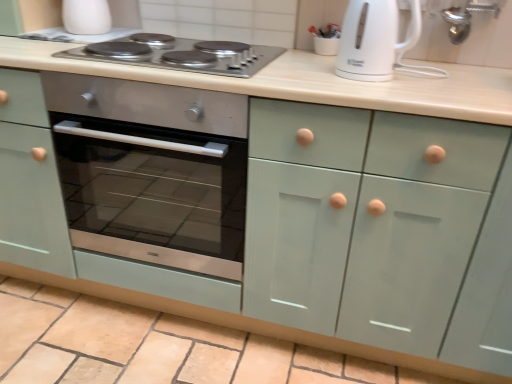
Question: Is stainless steel cooktop at upper center surrounded by white glossy cup at upper left?

Choices:
 (A) no
 (B) yes

Answer: (A)

Question: From the image's perspective, would you say white glossy cup at upper left is positioned over stainless steel cooktop at upper center?

Choices:
 (A) yes
 (B) no

Answer: (A)

Question: Is white glossy cup at upper left at the left side of stainless steel cooktop at upper center?

Choices:
 (A) no
 (B) yes

Answer: (B)

Question: Considering the relative positions of white glossy cup at upper left and stainless steel cooktop at upper center in the image provided, is white glossy cup at upper left to the right of stainless steel cooktop at upper center from the viewer's perspective?

Choices:
 (A) no
 (B) yes

Answer: (A)

Question: From a real-world perspective, is white glossy cup at upper left physically below stainless steel cooktop at upper center?

Choices:
 (A) no
 (B) yes

Answer: (A)

Question: Is stainless steel cooktop at upper center situated inside white glossy cup at upper left or outside?

Choices:
 (A) outside
 (B) inside

Answer: (A)

Question: In the image, is stainless steel cooktop at upper center on the left side or the right side of white glossy cup at upper left?

Choices:
 (A) left
 (B) right

Answer: (B)

Question: Relative to white glossy cup at upper left, is stainless steel cooktop at upper center in front or behind?

Choices:
 (A) behind
 (B) front

Answer: (B)

Question: From the image's perspective, is stainless steel cooktop at upper center located above or below white glossy cup at upper left?

Choices:
 (A) above
 (B) below

Answer: (B)

Question: Considering their positions, is white glossy cup at upper left located in front of or behind white glossy electric kettle at upper right?

Choices:
 (A) behind
 (B) front

Answer: (A)

Question: Looking at their shapes, would you say white glossy cup at upper left is wider or thinner than white glossy electric kettle at upper right?

Choices:
 (A) thin
 (B) wide

Answer: (A)

Question: Looking at the image, does white glossy cup at upper left seem bigger or smaller compared to white glossy electric kettle at upper right?

Choices:
 (A) big
 (B) small

Answer: (B)

Question: Is white glossy cup at upper left to the left or to the right of white glossy electric kettle at upper right in the image?

Choices:
 (A) left
 (B) right

Answer: (A)

Question: Is white glossy electric kettle at upper right taller or shorter than white glossy cup at upper left?

Choices:
 (A) tall
 (B) short

Answer: (A)

Question: From the image's perspective, is white glossy electric kettle at upper right above or below white glossy cup at upper left?

Choices:
 (A) above
 (B) below

Answer: (B)